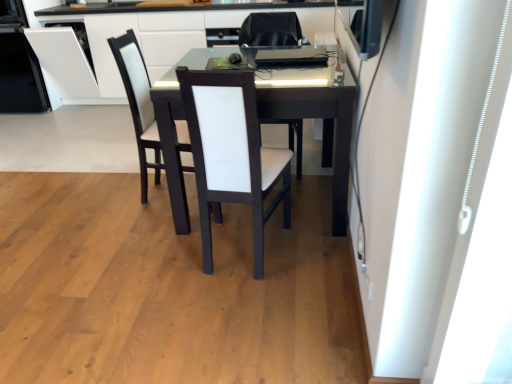
Question: From the image's perspective, is white leather chair at center, acting as the second chair starting from the front, located above or below white glossy dishwasher at left?

Choices:
 (A) above
 (B) below

Answer: (B)

Question: Looking at their shapes, would you say white leather chair at center, acting as the second chair starting from the front, is wider or thinner than white glossy dishwasher at left?

Choices:
 (A) wide
 (B) thin

Answer: (A)

Question: Based on their relative distances, which object is nearer to the white matte curtain at right?

Choices:
 (A) white leather chair at center, the first chair in the front-to-back sequence
 (B) matte black desk at center
 (C) white leather chair at center, acting as the second chair starting from the front
 (D) white leather swivel chair at center
 (E) white glossy dishwasher at left

Answer: (A)

Question: Estimate the real-world distances between objects in this image. Which object is farther from the white leather chair at center?

Choices:
 (A) white leather swivel chair at center
 (B) white leather chair at center, the first chair in the front-to-back sequence
 (C) matte black desk at center
 (D) white leather chair at center, acting as the second chair starting from the front
 (E) white glossy dishwasher at left

Answer: (E)